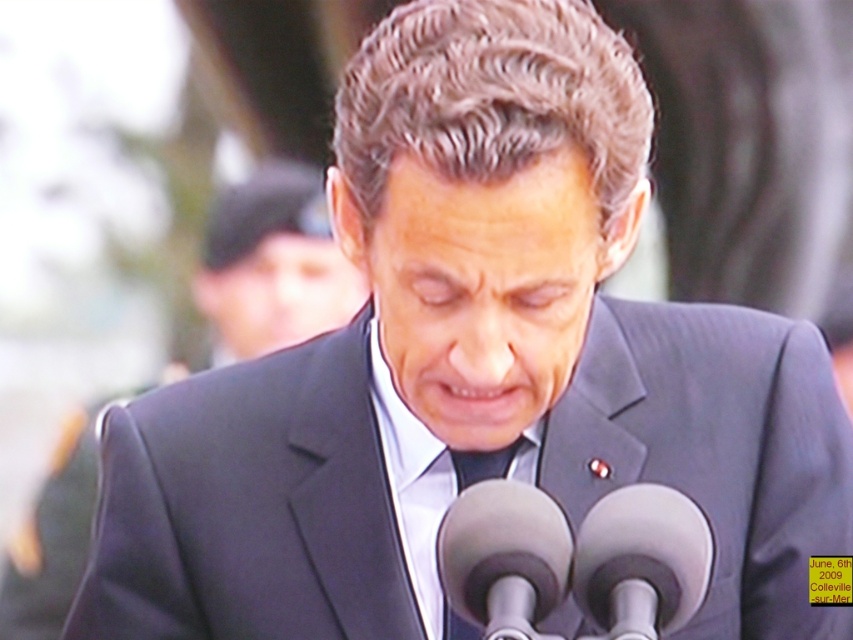
You are a photographer at an event and need to adjust the camera focus. The black matte suit at center and the smooth gray microphone at center are both in the frame. Based on their positions, which object should you focus on first to ensure the subject is clear?

The black matte suit at center is located above the smooth gray microphone at center, so you should focus on the black matte suit at center first since it is closer to the camera.

You are a photographer adjusting your camera settings to capture the man at the podium. You need to focus on both the black matte suit at center and the smooth gray microphone at center. Which object should you adjust your focus to first if you want to ensure the one closer to the camera is sharp?

The black matte suit at center is to the left of the smooth gray microphone at center, but since they are both at center, their distance from the camera is likely the same. Therefore, focusing on either should keep both sharp.